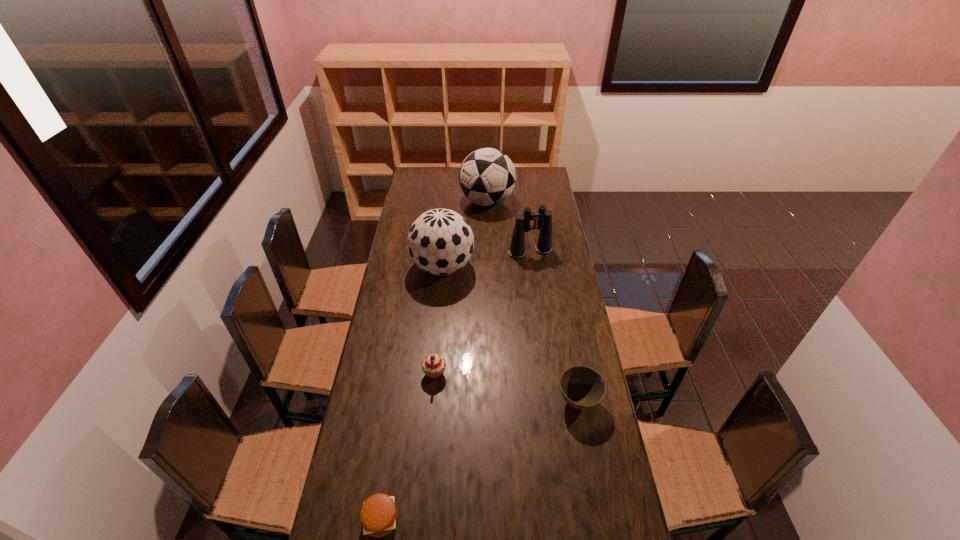
Locate an element on the screen. free space at the far edge of the desktop is located at coordinates (449, 179).

Where is `free space at the left edge of the desktop`? This screenshot has width=960, height=540. free space at the left edge of the desktop is located at coordinates (415, 205).

Where is `free space at the right edge`? free space at the right edge is located at coordinates (568, 254).

Locate an element on the screen. This screenshot has height=540, width=960. blank space at the far left corner is located at coordinates [424, 171].

You are a GUI agent. You are given a task and a screenshot of the screen. Output one action in this format:
    pyautogui.click(x=<x>, y=<y>)
    Task: Click on the vacant space that's between the nearest object and the cupcake
    
    Given the screenshot: What is the action you would take?
    pyautogui.click(x=408, y=447)

Where is `vacant point located between the third tallest object and the bowl`? This screenshot has height=540, width=960. vacant point located between the third tallest object and the bowl is located at coordinates (554, 326).

This screenshot has width=960, height=540. In order to click on empty space between the bowl and the nearer soccer ball in this screenshot , I will do `click(511, 334)`.

You are a GUI agent. You are given a task and a screenshot of the screen. Output one action in this format:
    pyautogui.click(x=<x>, y=<y>)
    Task: Click on the vacant area that lies between the binoculars and the nearer soccer ball
    The width and height of the screenshot is (960, 540).
    Given the screenshot: What is the action you would take?
    pyautogui.click(x=487, y=259)

The height and width of the screenshot is (540, 960). Identify the location of vacant area that lies between the nearer soccer ball and the bowl. (511, 334).

This screenshot has width=960, height=540. I want to click on free space between the fifth tallest object and the farthest object, so tap(533, 301).